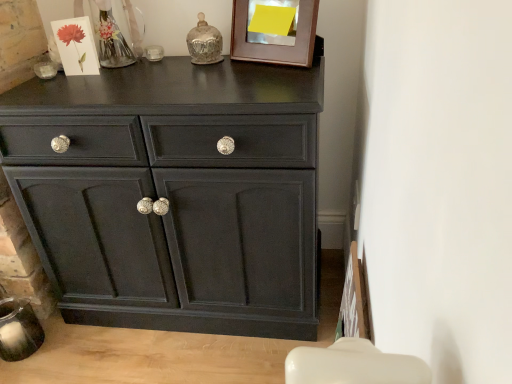
Question: In terms of size, does wooden picture frame at upper center appear bigger or smaller than matte black cabinet at center?

Choices:
 (A) big
 (B) small

Answer: (B)

Question: Choose the correct answer: Is wooden picture frame at upper center inside matte black cabinet at center or outside it?

Choices:
 (A) inside
 (B) outside

Answer: (B)

Question: Looking at their shapes, would you say wooden picture frame at upper center is wider or thinner than matte black cabinet at center?

Choices:
 (A) wide
 (B) thin

Answer: (B)

Question: Considering the positions of matte black cabinet at center and wooden picture frame at upper center in the image, is matte black cabinet at center bigger or smaller than wooden picture frame at upper center?

Choices:
 (A) big
 (B) small

Answer: (A)

Question: Would you say matte black cabinet at center is to the left or to the right of wooden picture frame at upper center in the picture?

Choices:
 (A) right
 (B) left

Answer: (B)

Question: Is matte black cabinet at center in front of or behind wooden picture frame at upper center in the image?

Choices:
 (A) front
 (B) behind

Answer: (A)

Question: Looking at their shapes, would you say matte black cabinet at center is wider or thinner than wooden picture frame at upper center?

Choices:
 (A) thin
 (B) wide

Answer: (B)